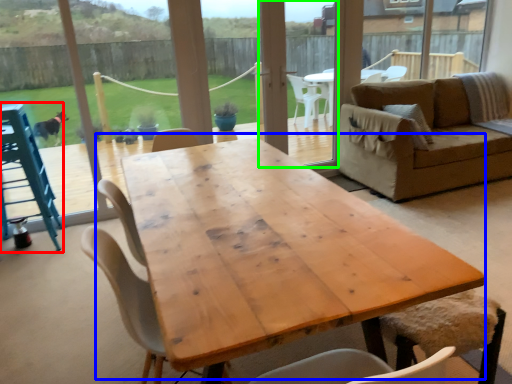
Question: Which object is the closest to the feeding chair (highlighted by a red box)? Choose among these: coffee table (highlighted by a blue box) or screen door (highlighted by a green box).

Choices:
 (A) coffee table
 (B) screen door

Answer: (A)